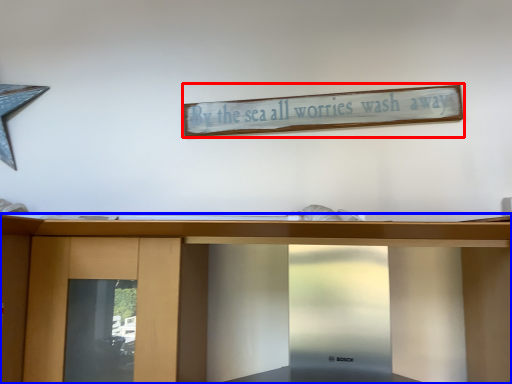
Question: Which point is closer to the camera, bulletin board (highlighted by a red box) or furniture (highlighted by a blue box)?

Choices:
 (A) bulletin board
 (B) furniture

Answer: (B)